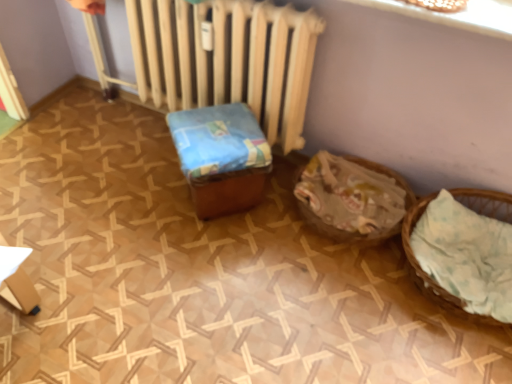
Find the location of a particular element. This screenshot has width=512, height=384. vacant region in front of brown woven basket at lower right, the second basket positioned from the right is located at coordinates (332, 307).